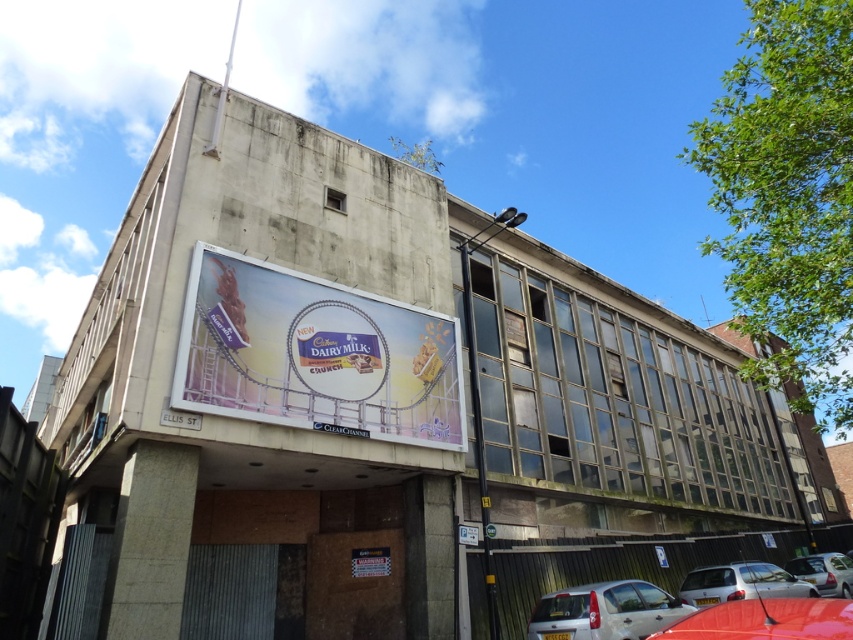
You are a delivery driver who needs to park your silver metallic hatchback at lower center near the white glossy billboard at center. Given that the billboard is larger than the hatchback, will the billboard block the hatchback from being visible from the main road?

The white glossy billboard at center has a larger size compared to the silver metallic hatchback at lower center. Since the billboard is bigger, it could potentially block the hatchback from being seen from the main road depending on their positioning.

You are a photographer trying to capture both the shiny red car at lower right and the white glossy car at lower right in a single shot. Which car should you position closer to the camera to ensure both are fully visible in the frame?

You should position the shiny red car at lower right closer to the camera since it is smaller in size compared to the white glossy car at lower right. This will help balance their sizes in the frame, ensuring both are fully visible.